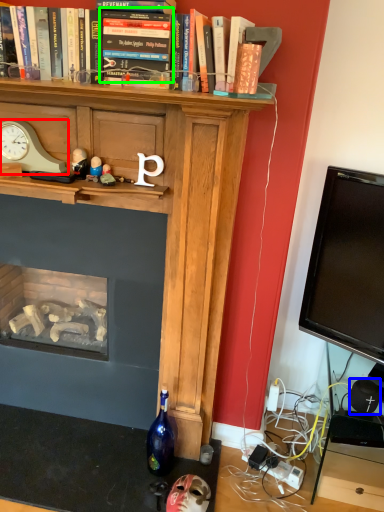
Question: Considering the real-world distances, which object is closest to clock (highlighted by a red box)? speaker (highlighted by a blue box) or book (highlighted by a green box).

Choices:
 (A) speaker
 (B) book

Answer: (B)